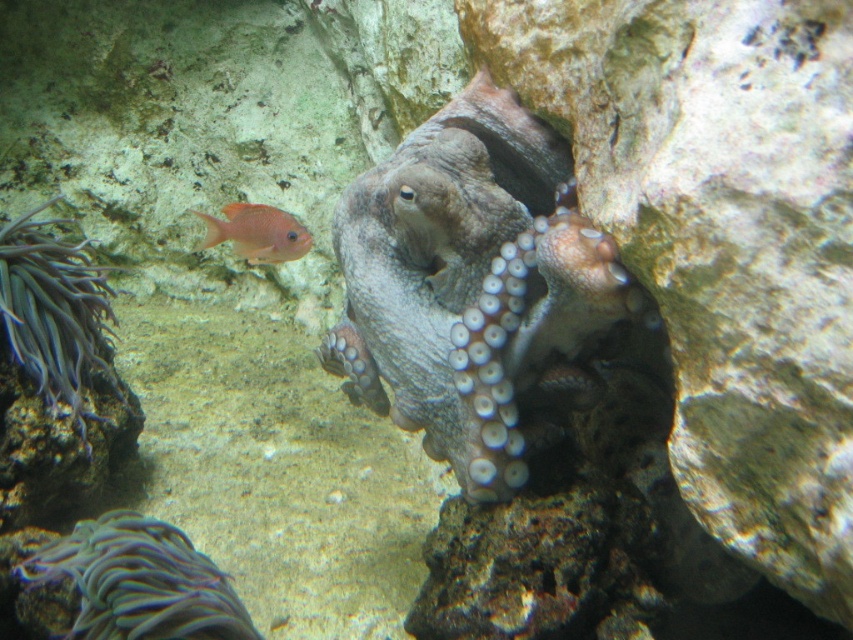
Based on the photo, based on the scene, which object is taller between the gray matte octopus at center and the gray soft anemone at left?

The gray matte octopus at center is much taller than the gray soft anemone at left.